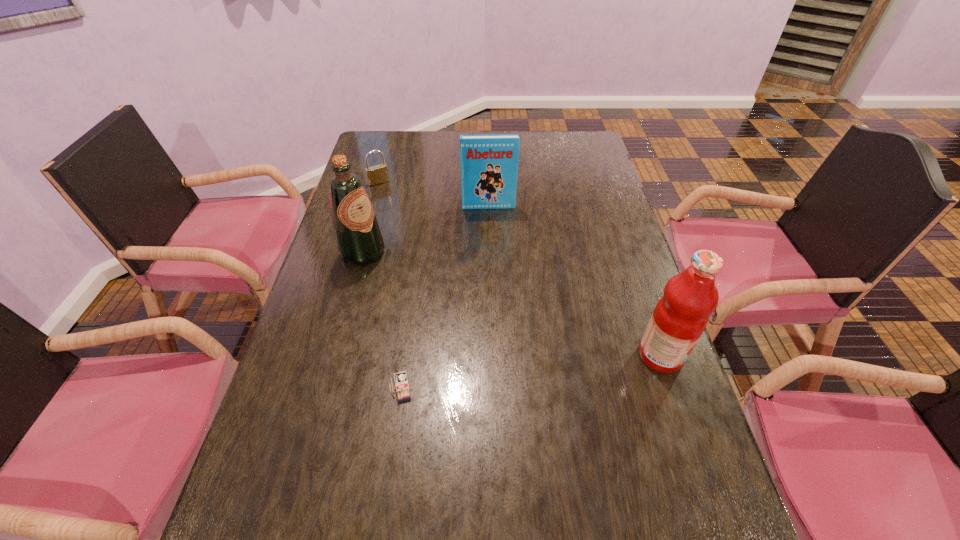
At what (x,y) coordinates should I click in order to perform the action: click on free spot between the farthest object and the fourth nearest object. Please return your answer as a coordinate pair (x, y). Image resolution: width=960 pixels, height=540 pixels. Looking at the image, I should click on (434, 195).

The width and height of the screenshot is (960, 540). Identify the location of free spot between the matchbox and the fruit juice. (531, 372).

Image resolution: width=960 pixels, height=540 pixels. I want to click on vacant space that's between the third farthest object and the rightmost object, so coord(512,305).

This screenshot has width=960, height=540. I want to click on object that is the closest to the book, so (x=359, y=241).

The width and height of the screenshot is (960, 540). What are the coordinates of `object that ranks as the closest to the book` in the screenshot? It's located at (359, 241).

The height and width of the screenshot is (540, 960). What are the coordinates of `free space that satisfies the following two spatial constraints: 1. on the front side of the padlock; 2. on the right side of the third shortest object` in the screenshot? It's located at coord(372,207).

I want to click on vacant space that satisfies the following two spatial constraints: 1. on the front side of the padlock; 2. on the front label of the fruit juice, so click(x=331, y=356).

Find the location of a particular element. The width and height of the screenshot is (960, 540). free space that satisfies the following two spatial constraints: 1. on the back side of the second farthest object; 2. on the right side of the olive oil is located at coordinates (375, 207).